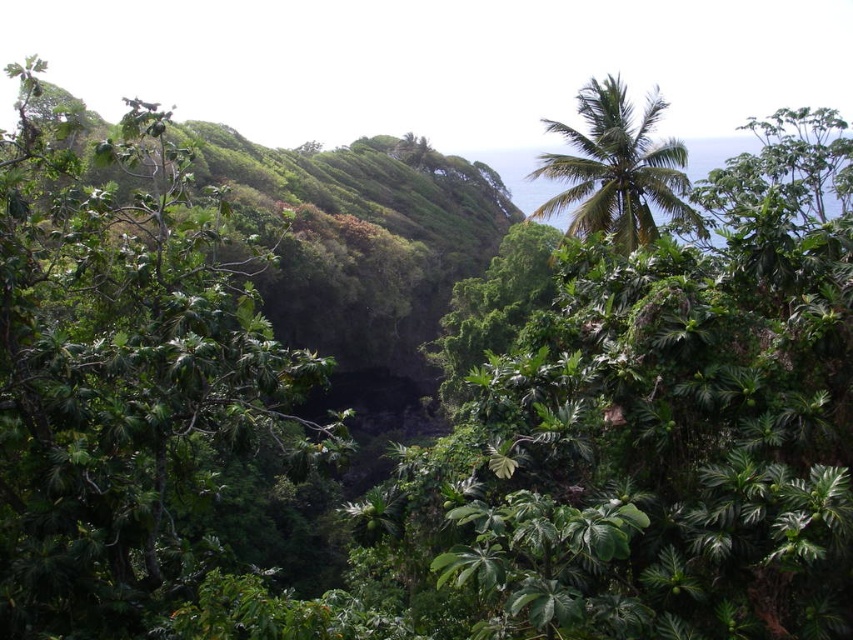
Question: Does green leafy tree at center appear on the left side of green leafy palm tree at upper right?

Choices:
 (A) no
 (B) yes

Answer: (B)

Question: Which object is farther from the camera taking this photo?

Choices:
 (A) green leafy palm tree at upper right
 (B) green leafy tree at center

Answer: (A)

Question: Where is green leafy tree at center located in relation to green leafy palm tree at upper right in the image?

Choices:
 (A) left
 (B) right

Answer: (A)

Question: From the image, what is the correct spatial relationship of green leafy tree at center in relation to green leafy palm tree at upper right?

Choices:
 (A) left
 (B) right

Answer: (A)